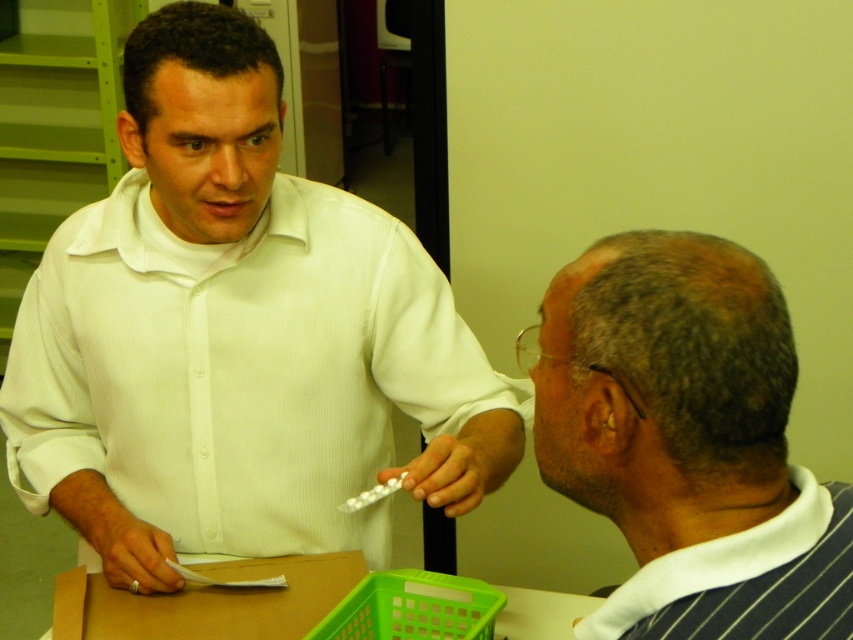
You are organizing a storage space and need to place the striped fabric shirt at right and the green plastic crate at lower center. If the crate must be placed under the shirt, will the shirt fit over the crate without any issues?

The striped fabric shirt at right is bigger than the green plastic crate at lower center, so the shirt will fit over the crate without any issues.

Based on the photo, you are a visitor in an office and see the white matte shirt at center and the striped fabric shirt at right. Which person is standing higher?

The white matte shirt at center is much taller than the striped fabric shirt at right, so the person wearing the white matte shirt at center is standing higher.